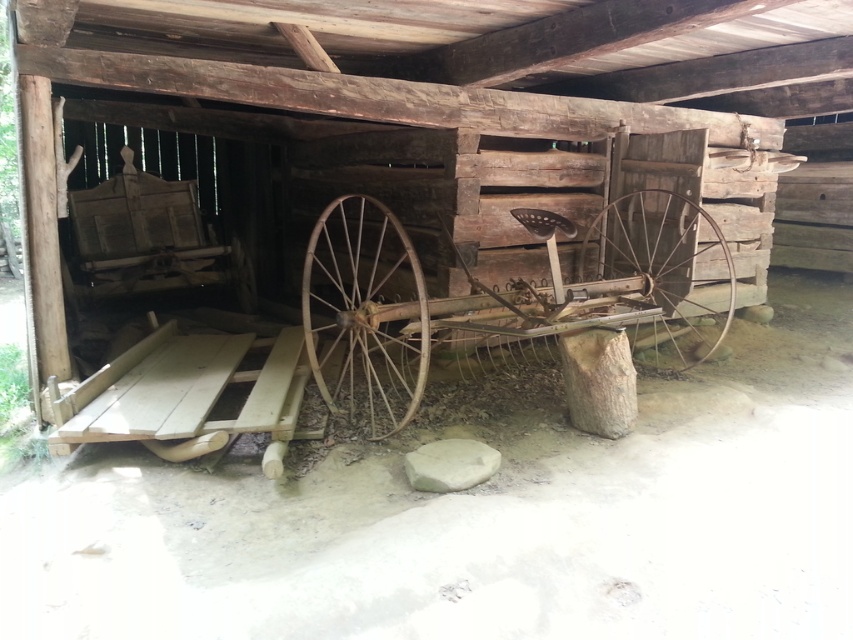
Question: Does rusty metal wagon wheel at center lie in front of rusty metal wheel at center?

Choices:
 (A) no
 (B) yes

Answer: (B)

Question: Estimate the real-world distances between objects in this image. Which object is closer to the rusty metal wagon wheel at center?

Choices:
 (A) rusty metal cart at center
 (B) rusty metal wheel at center

Answer: (A)

Question: Which of the following is the closest to the observer?

Choices:
 (A) rusty metal wheel at center
 (B) rusty metal wagon wheel at center

Answer: (B)

Question: Does rusty metal cart at center have a lesser width compared to rusty metal wagon wheel at center?

Choices:
 (A) no
 (B) yes

Answer: (A)

Question: Is rusty metal cart at center below rusty metal wagon wheel at center?

Choices:
 (A) yes
 (B) no

Answer: (B)

Question: Which point is farther from the camera taking this photo?

Choices:
 (A) (335, 362)
 (B) (679, 320)

Answer: (B)